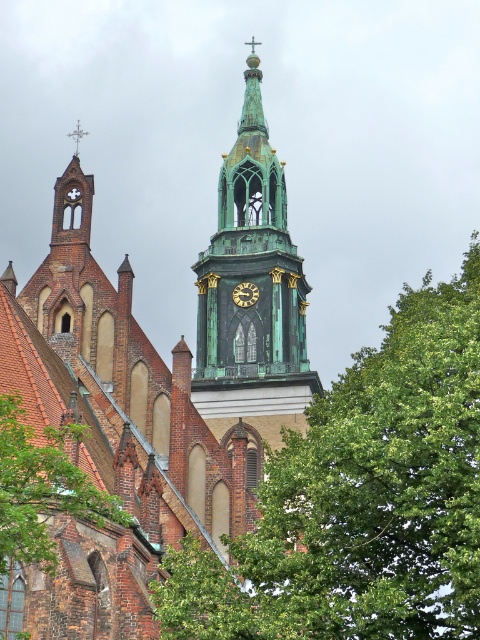
Based on the photo, you are standing in front of the historic church and notice two green leafy trees. One is the green leafy tree at center, and the other is the green leafy tree at lower left. Which tree is closer to the tower?

The green leafy tree at center is positioned over the green leafy tree at lower left, meaning it is closer to the tower.

You are a maintenance worker needing to inspect the green copper steeple at upper center and the green leafy tree at lower left. Given that your ladder can extend up to 10 meters, can you safely reach both objects with the ladder from the ground?

The distance between the green copper steeple at upper center and the green leafy tree at lower left is 12.75 meters. Since your ladder only extends to 10 meters, you cannot safely reach both objects with the ladder from the ground.